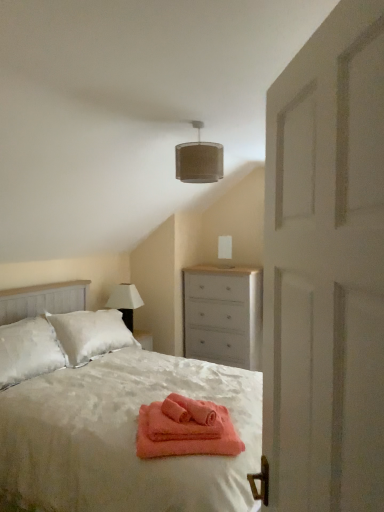
Question: Should I look upward or downward to see white fabric lampshade at upper left?

Choices:
 (A) down
 (B) up

Answer: (A)

Question: Does white satin bed at center lie behind beige fabric lampshade at upper center?

Choices:
 (A) yes
 (B) no

Answer: (B)

Question: From a real-world perspective, is white satin bed at center physically below beige fabric lampshade at upper center?

Choices:
 (A) yes
 (B) no

Answer: (A)

Question: Considering the relative sizes of white satin bed at center and beige fabric lampshade at upper center in the image provided, is white satin bed at center bigger than beige fabric lampshade at upper center?

Choices:
 (A) no
 (B) yes

Answer: (B)

Question: From a real-world perspective, is white satin bed at center positioned over beige fabric lampshade at upper center based on gravity?

Choices:
 (A) yes
 (B) no

Answer: (B)

Question: Is white satin bed at center positioned beyond the bounds of beige fabric lampshade at upper center?

Choices:
 (A) no
 (B) yes

Answer: (B)

Question: Is white satin bed at center positioned before beige fabric lampshade at upper center?

Choices:
 (A) no
 (B) yes

Answer: (B)

Question: Is white painted wood chest of drawers at center directly adjacent to white satin bed at center?

Choices:
 (A) yes
 (B) no

Answer: (B)

Question: From the image's perspective, does white painted wood chest of drawers at center appear higher than white satin bed at center?

Choices:
 (A) no
 (B) yes

Answer: (B)

Question: Considering the relative sizes of white painted wood chest of drawers at center and white satin bed at center in the image provided, is white painted wood chest of drawers at center shorter than white satin bed at center?

Choices:
 (A) yes
 (B) no

Answer: (A)

Question: Is white painted wood chest of drawers at center facing away from white satin bed at center?

Choices:
 (A) yes
 (B) no

Answer: (B)

Question: Considering the relative positions of white painted wood chest of drawers at center and white satin bed at center in the image provided, is white painted wood chest of drawers at center behind white satin bed at center?

Choices:
 (A) yes
 (B) no

Answer: (A)

Question: Is white painted wood chest of drawers at center thinner than white satin bed at center?

Choices:
 (A) yes
 (B) no

Answer: (A)

Question: Is white painted wood chest of drawers at center at the right side of white wooden door at right?

Choices:
 (A) yes
 (B) no

Answer: (A)